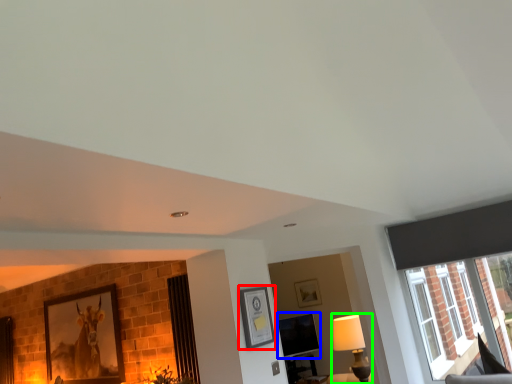
Question: Which object is the farthest from picture frame (highlighted by a red box)? Choose among these: window screen (highlighted by a blue box) or lamp (highlighted by a green box).

Choices:
 (A) window screen
 (B) lamp

Answer: (A)